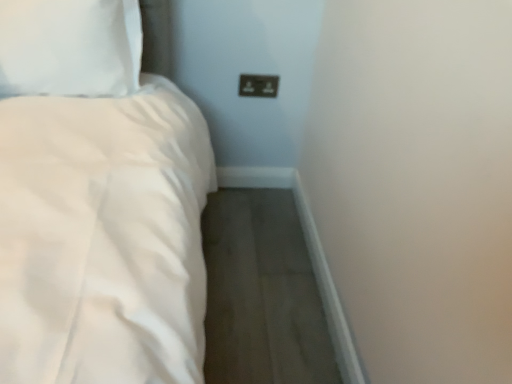
Question: Based on their sizes in the image, would you say brown plastic socket at upper center is bigger or smaller than white soft pillow at upper left?

Choices:
 (A) small
 (B) big

Answer: (A)

Question: From a real-world perspective, is brown plastic socket at upper center above or below white soft pillow at upper left?

Choices:
 (A) above
 (B) below

Answer: (B)

Question: Is brown plastic socket at upper center to the left or to the right of white soft pillow at upper left in the image?

Choices:
 (A) right
 (B) left

Answer: (A)

Question: From the image's perspective, is white soft pillow at upper left located above or below brown plastic socket at upper center?

Choices:
 (A) below
 (B) above

Answer: (B)

Question: Choose the correct answer: Is white soft pillow at upper left inside brown plastic socket at upper center or outside it?

Choices:
 (A) outside
 (B) inside

Answer: (A)

Question: Relative to brown plastic socket at upper center, is white soft pillow at upper left in front or behind?

Choices:
 (A) behind
 (B) front

Answer: (B)

Question: From their relative heights in the image, would you say white soft pillow at upper left is taller or shorter than brown plastic socket at upper center?

Choices:
 (A) short
 (B) tall

Answer: (B)